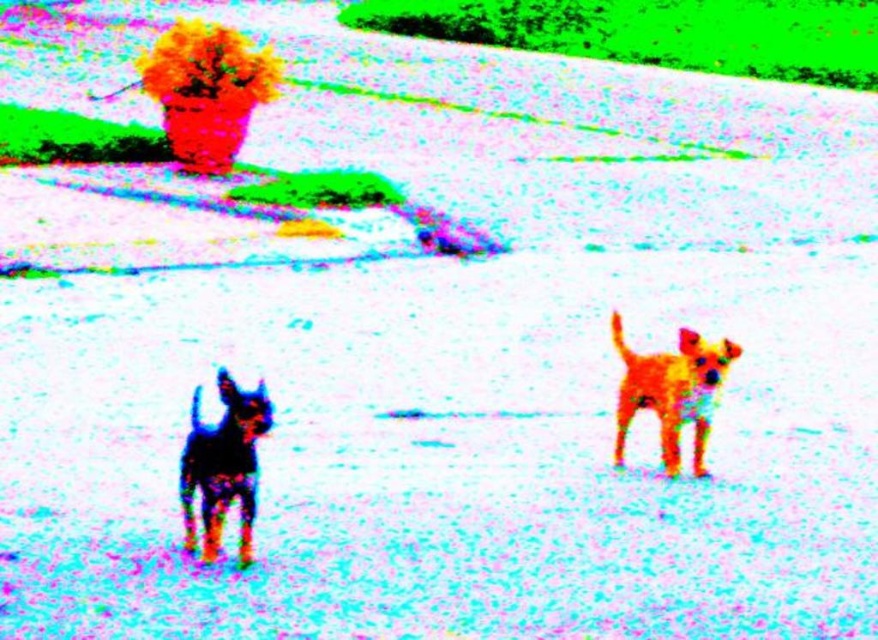
Question: Which point is farther from the camera taking this photo?

Choices:
 (A) (651, 381)
 (B) (252, 458)

Answer: (A)

Question: Is black glossy dog at left bigger than shiny golden dog at center?

Choices:
 (A) no
 (B) yes

Answer: (A)

Question: Among these objects, which one is nearest to the camera?

Choices:
 (A) black glossy dog at left
 (B) shiny golden dog at center

Answer: (A)

Question: Is black glossy dog at left thinner than shiny golden dog at center?

Choices:
 (A) no
 (B) yes

Answer: (B)

Question: Does black glossy dog at left lie behind shiny golden dog at center?

Choices:
 (A) yes
 (B) no

Answer: (B)

Question: Which point is farther from the camera taking this photo?

Choices:
 (A) (696, 358)
 (B) (193, 403)

Answer: (A)